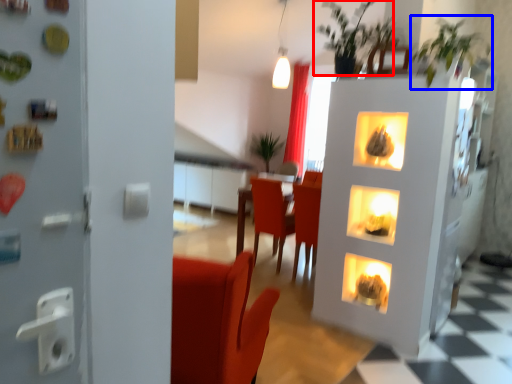
Question: Which of the following is the closest to the observer, plant (highlighted by a red box) or plant (highlighted by a blue box)?

Choices:
 (A) plant
 (B) plant

Answer: (B)